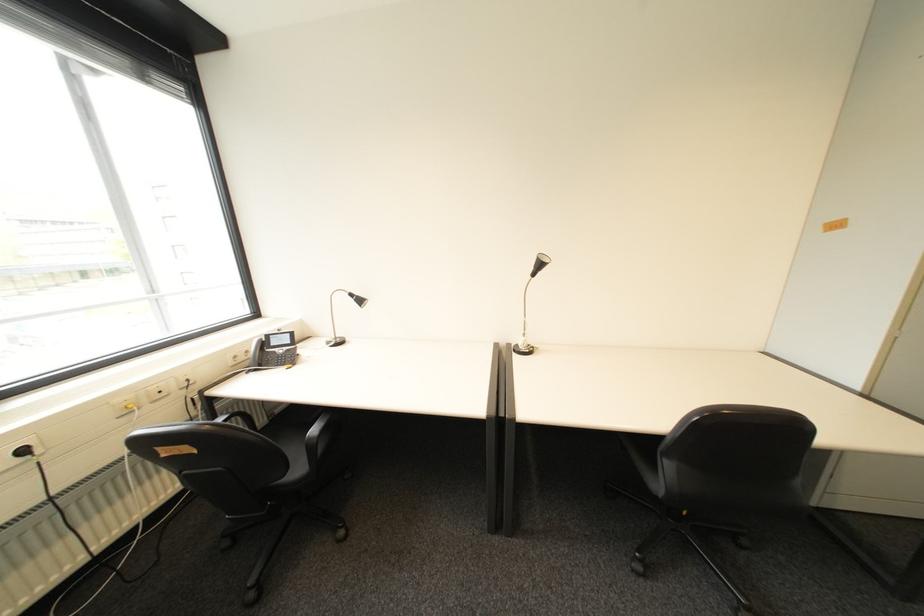
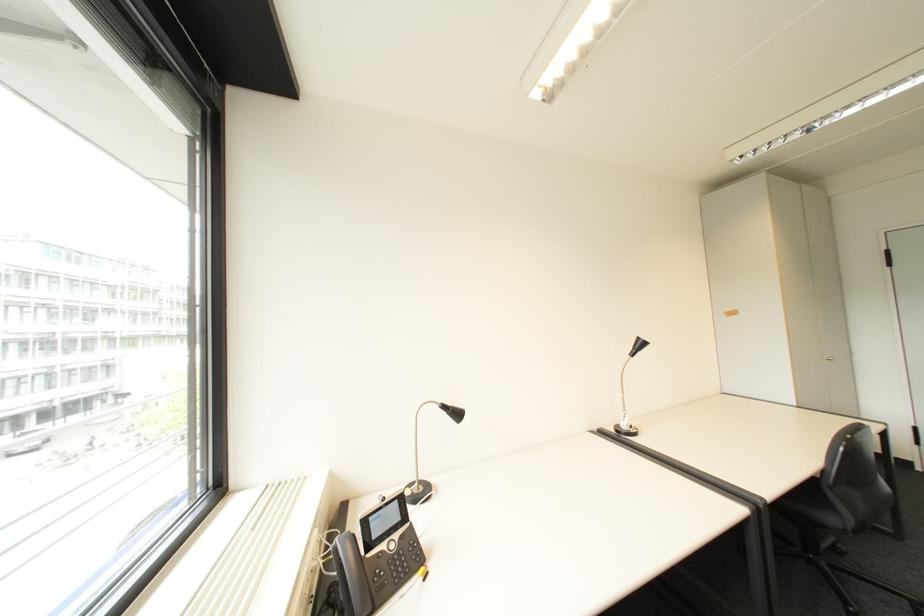
Where in the second image is the point corresponding to [361,296] from the first image?

(455, 407)